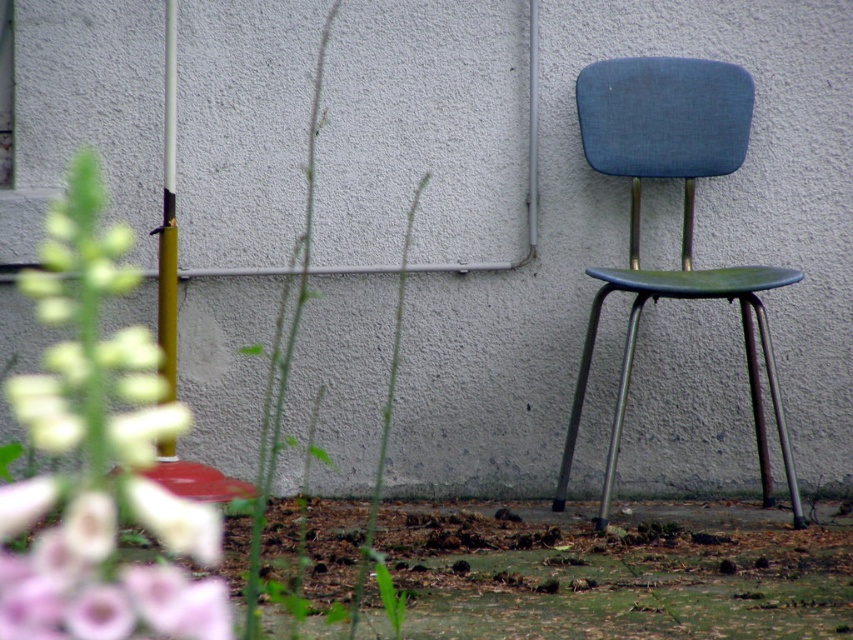
Question: Estimate the real-world distances between objects in this image. Which object is closer to the green leafy stem at center?

Choices:
 (A) white fuzzy flowers at lower left
 (B) blue fabric chair at right

Answer: (A)

Question: Does white fuzzy flowers at lower left have a smaller size compared to green leafy stem at center?

Choices:
 (A) no
 (B) yes

Answer: (A)

Question: Which point is farther from the camera taking this photo?

Choices:
 (A) (367, 564)
 (B) (67, 602)

Answer: (A)

Question: Which point is farther to the camera?

Choices:
 (A) white fuzzy flowers at lower left
 (B) blue fabric chair at right
 (C) green leafy stem at center

Answer: (B)

Question: Can you confirm if white fuzzy flowers at lower left is positioned above blue fabric chair at right?

Choices:
 (A) no
 (B) yes

Answer: (A)

Question: Can you confirm if blue fabric chair at right is smaller than green leafy stem at center?

Choices:
 (A) yes
 (B) no

Answer: (B)